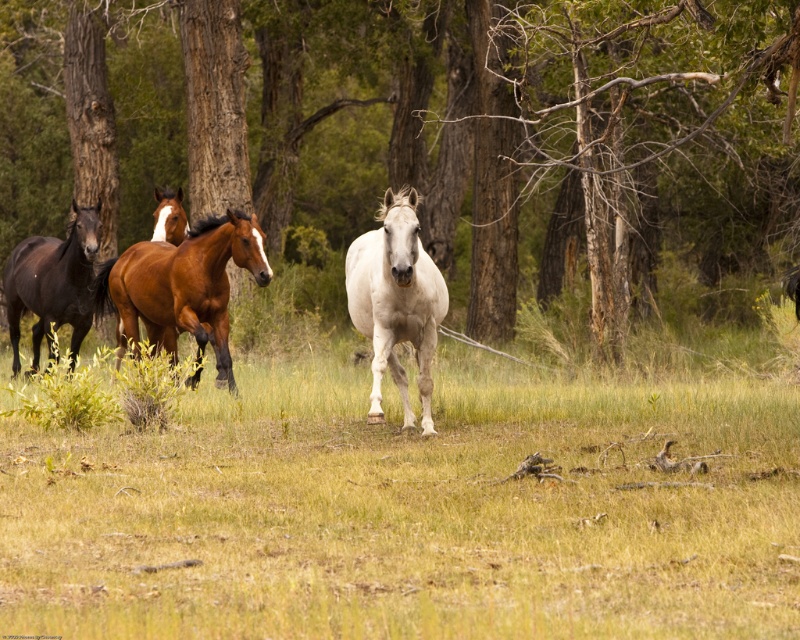
You are a photographer standing in the field and want to take a photo of the white glossy horse at center and the shiny brown horse at left. Which horse will appear larger in the photo?

The white glossy horse at center will appear larger in the photo because it is closer to the viewer than the shiny brown horse at left.

You are standing in the field and want to take a photo of the brown wood tree at center. Where should you position yourself to capture it in the frame?

The brown wood tree at center is located at coordinates point (432,134), so you should position yourself facing that point to capture it in the frame.

You are standing in the field and want to locate the white glossy horse at center. What are its coordinates?

The white glossy horse at center is located at coordinates point (x=396, y=301).